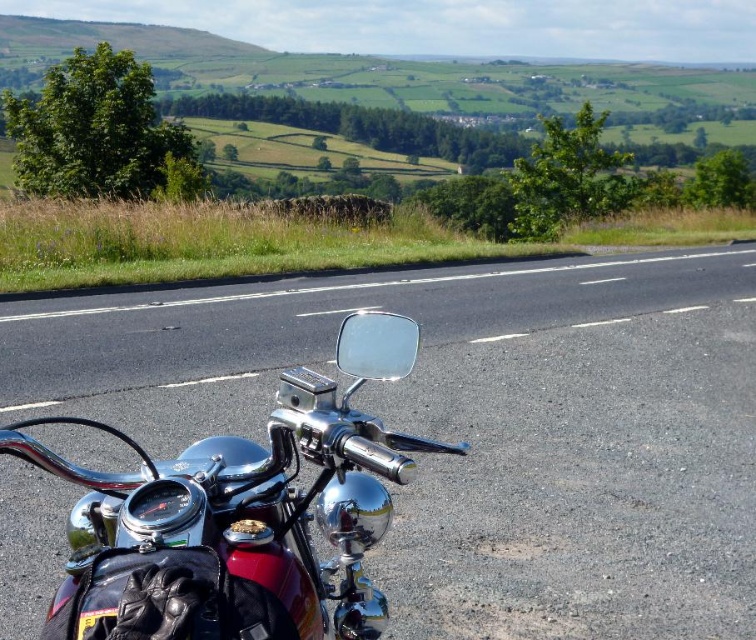
Between black asphalt road at center and green grass at upper left, which one has less height?

Standing shorter between the two is black asphalt road at center.

Is the position of black asphalt road at center more distant than that of green grass at upper left?

No, black asphalt road at center is in front of green grass at upper left.

The width and height of the screenshot is (756, 640). I want to click on black asphalt road at center, so click(x=251, y=515).